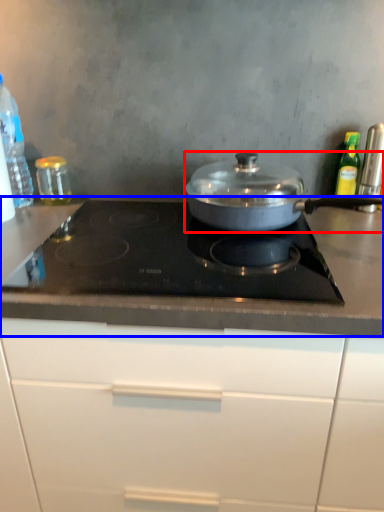
Question: Which object is closer to the camera taking this photo, kitchen appliance (highlighted by a red box) or countertop (highlighted by a blue box)?

Choices:
 (A) kitchen appliance
 (B) countertop

Answer: (B)